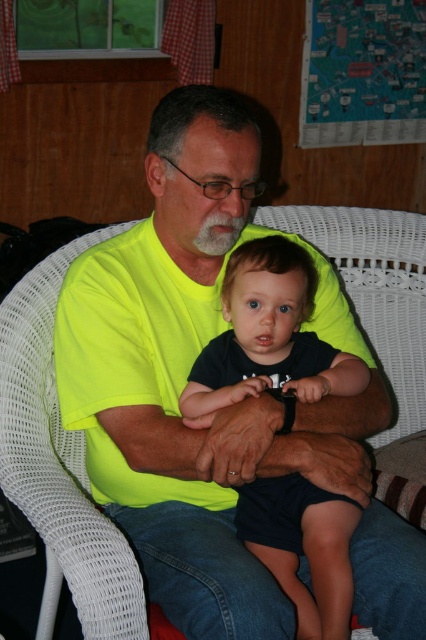
Based on the coordinates provided, which object is located at point (187, 372) in the image?

The neon yellow T shirt at center is located at point (187, 372).